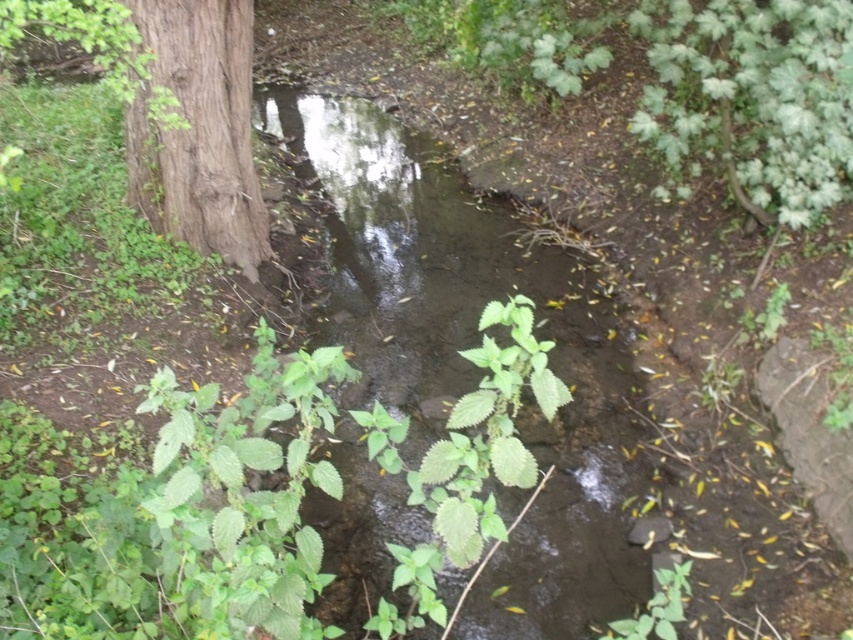
Can you confirm if transparent water at center is bigger than brown rough tree trunk at left?

Yes.

Is point (303, 144) positioned in front of point (192, 8)?

No, it is behind (192, 8).

At what (x,y) coordinates should I click in order to perform the action: click on transparent water at center. Please return your answer as a coordinate pair (x, y). This screenshot has height=640, width=853. Looking at the image, I should click on (466, 358).